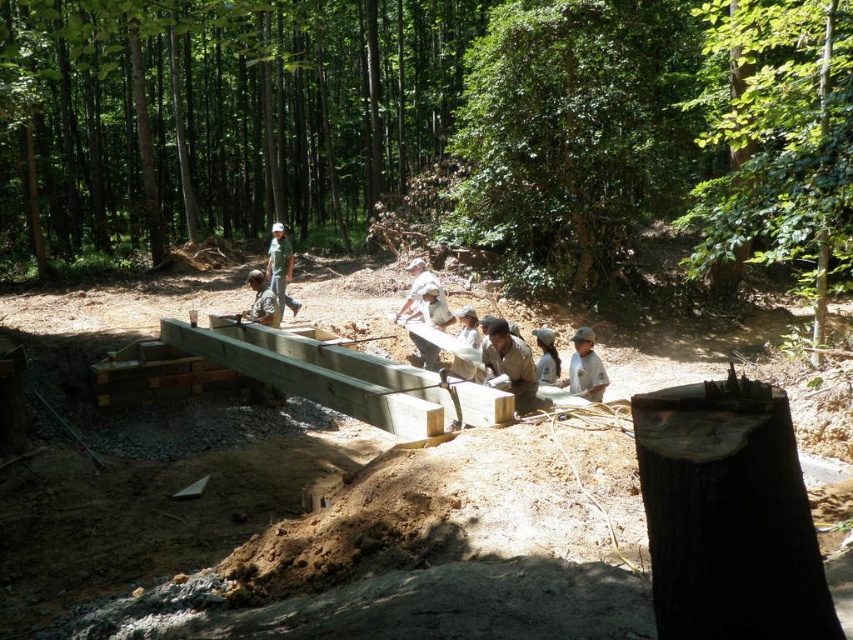
Question: Which of the following is the farthest from the observer?

Choices:
 (A) (486, 120)
 (B) (592, 369)

Answer: (A)

Question: Observing the image, what is the correct spatial positioning of dark brown wood at lower right in reference to light brown wood at center?

Choices:
 (A) left
 (B) right

Answer: (A)

Question: Can you confirm if light brown wood at center is positioned to the left of white fabric shirt at center?

Choices:
 (A) yes
 (B) no

Answer: (B)

Question: Estimate the real-world distances between objects in this image. Which object is closer to the green matte shirt at center?

Choices:
 (A) dark brown wood at lower right
 (B) white fabric shirt at center

Answer: (B)

Question: Does dark brown wood at lower right appear over light brown wood at center?

Choices:
 (A) yes
 (B) no

Answer: (A)

Question: Which point is farther to the camera?

Choices:
 (A) smooth wooden beams at center
 (B) green matte shirt at center

Answer: (B)